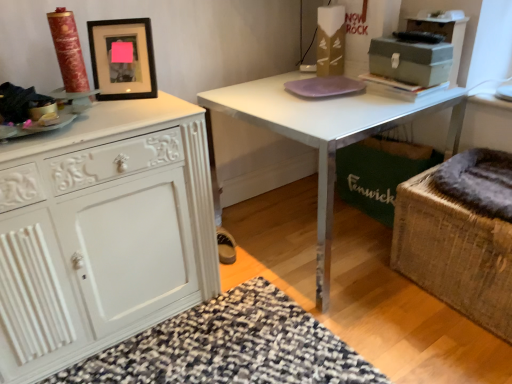
Where is `free point above metallic gray cabinet at upper right (from a real-world perspective)`? The image size is (512, 384). free point above metallic gray cabinet at upper right (from a real-world perspective) is located at coordinates (437, 13).